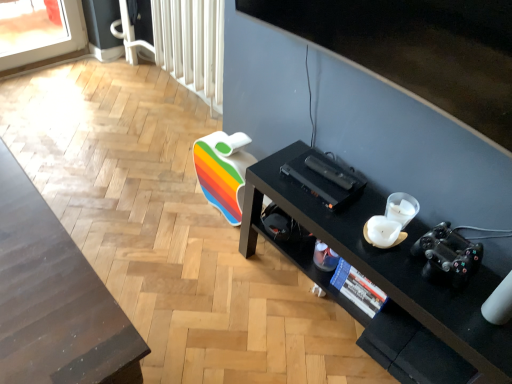
Image resolution: width=512 pixels, height=384 pixels. In order to click on free space in front of black matte video camera at lower right in this screenshot , I will do `click(455, 317)`.